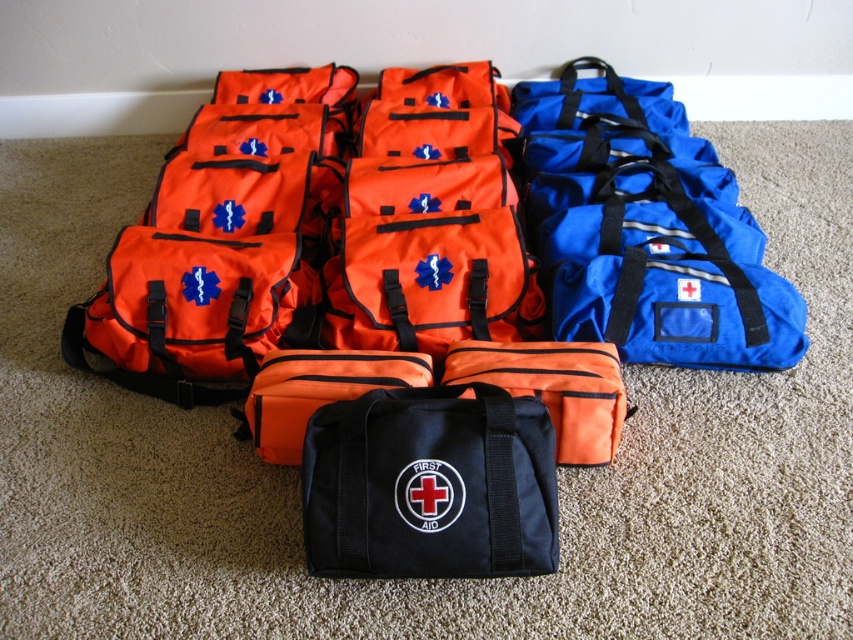
Question: Is orange fabric first aid kit at center above black fabric first aid kit at center?

Choices:
 (A) no
 (B) yes

Answer: (B)

Question: Among these points, which one is nearest to the camera?

Choices:
 (A) (392, 492)
 (B) (801, 323)

Answer: (A)

Question: Does orange fabric first aid kit at center have a lesser width compared to black fabric first aid kit at center?

Choices:
 (A) yes
 (B) no

Answer: (B)

Question: Is orange fabric first aid kit at center further to camera compared to black fabric first aid kit at center?

Choices:
 (A) yes
 (B) no

Answer: (A)

Question: Which point is farther to the camera?

Choices:
 (A) black fabric first aid kit at center
 (B) orange fabric first aid kit at center

Answer: (B)

Question: Which of the following is the closest to the observer?

Choices:
 (A) (352, 435)
 (B) (351, 506)

Answer: (B)